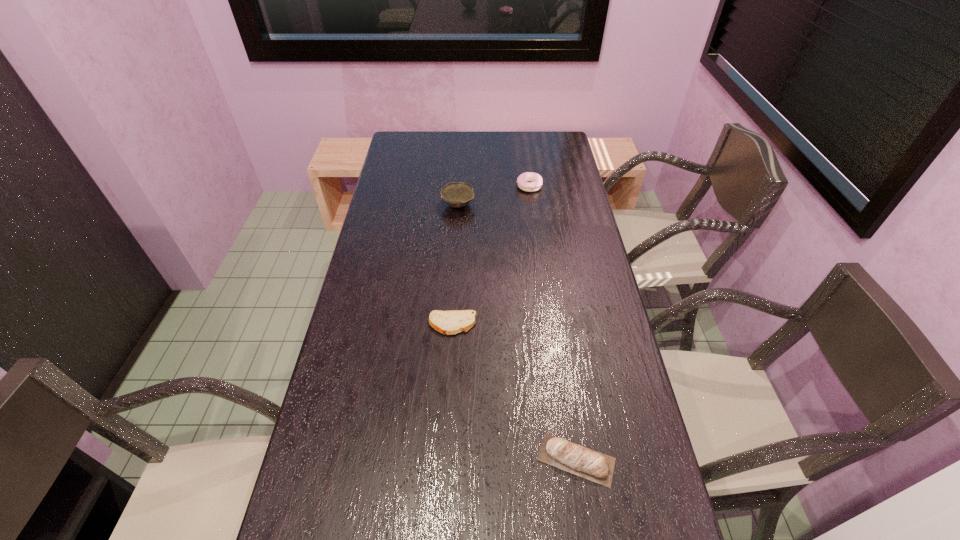
Identify the location of free space located on the right of the shortest object. Image resolution: width=960 pixels, height=540 pixels. (571, 325).

Find the location of a particular element. This screenshot has height=540, width=960. doughnut located in the right edge section of the desktop is located at coordinates (523, 180).

You are a GUI agent. You are given a task and a screenshot of the screen. Output one action in this format:
    pyautogui.click(x=<x>, y=<y>)
    Task: Click on the pita bread at the right edge
    This screenshot has height=540, width=960.
    Given the screenshot: What is the action you would take?
    pyautogui.click(x=584, y=462)

In the image, there is a desktop. Where is `vacant space at the far edge`? vacant space at the far edge is located at coordinates (496, 133).

In the image, there is a desktop. Where is `vacant region at the left edge`? The image size is (960, 540). vacant region at the left edge is located at coordinates (395, 209).

Where is `vacant space at the right edge of the desktop`? vacant space at the right edge of the desktop is located at coordinates (566, 191).

Where is `free space at the far left corner`? The width and height of the screenshot is (960, 540). free space at the far left corner is located at coordinates (401, 145).

I want to click on free space between the farthest object and the nearest object, so click(x=553, y=323).

This screenshot has height=540, width=960. In order to click on vacant area that lies between the third nearest object and the farther pita bread in this screenshot , I will do `click(455, 265)`.

Where is `vacant region between the second nearest object and the tallest object`? vacant region between the second nearest object and the tallest object is located at coordinates (455, 265).